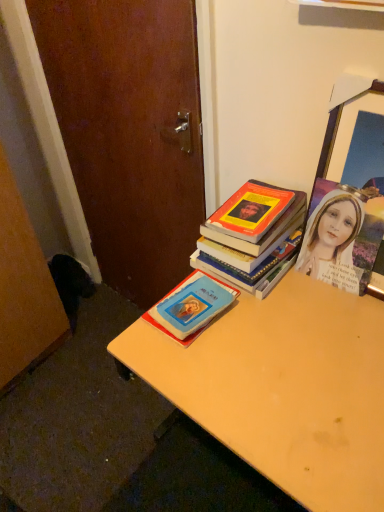
The height and width of the screenshot is (512, 384). I want to click on blank space above hardcover book at center, which is the second book from bottom to top (from a real-world perspective), so click(x=257, y=207).